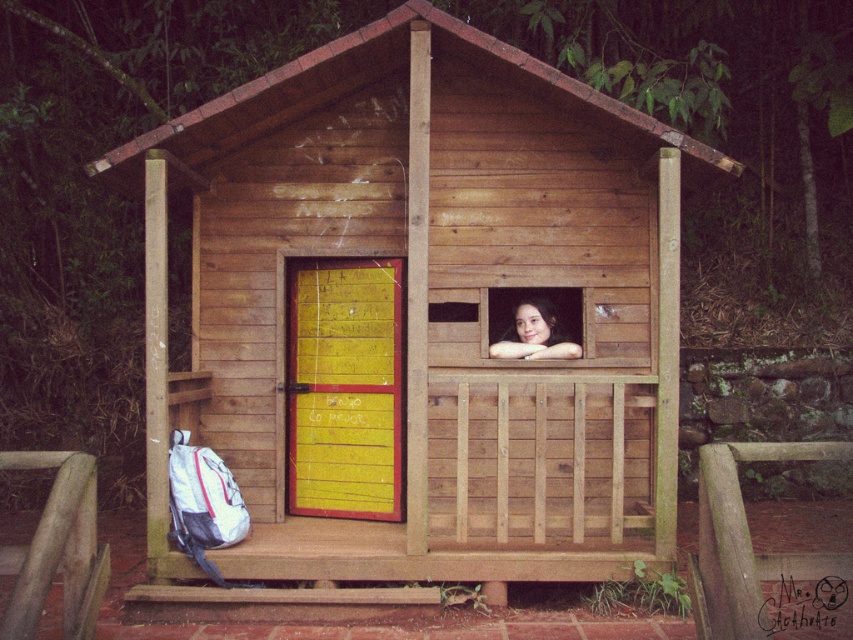
Does point (274, 390) come in front of point (747, 444)?

No, it is behind (747, 444).

Does point (305, 509) come closer to viewer compared to point (734, 554)?

No, (305, 509) is further to viewer.

Identify the location of wooden cabin at center. (421, 312).

Who is more forward, (260, 541) or (556, 342)?

Point (260, 541) is in front.

The width and height of the screenshot is (853, 640). What are the coordinates of `wooden bench at lower center` in the screenshot? It's located at [x=740, y=520].

Is point (627, 236) positioned behind point (498, 353)?

Yes, point (627, 236) is behind point (498, 353).

Is point (556, 428) positioned in front of point (521, 323)?

Yes, point (556, 428) is in front of point (521, 323).

Find the location of a particular element. The image size is (853, 640). wooden cabin at center is located at coordinates (421, 312).